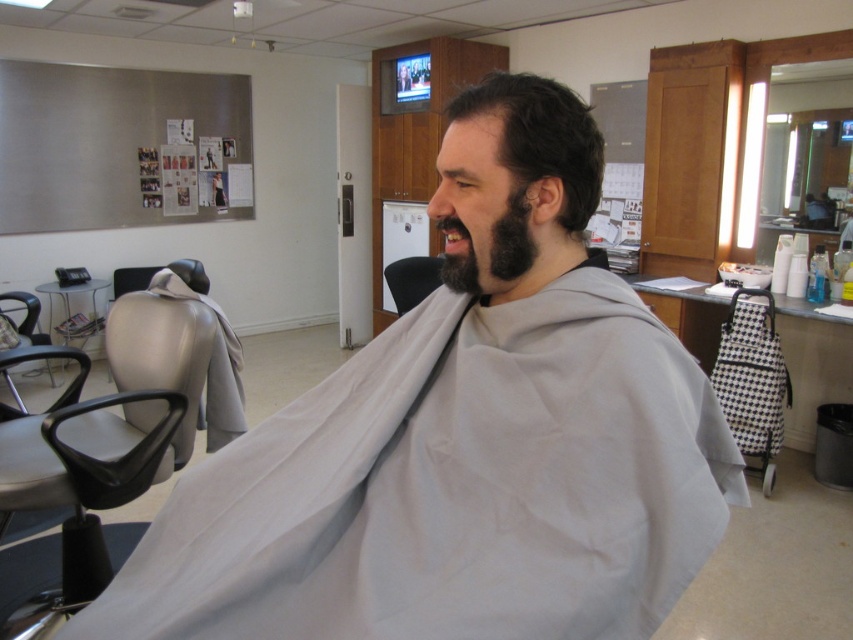
Question: From the image, what is the correct spatial relationship of black fuzzy beard at center in relation to black leather chair at center?

Choices:
 (A) left
 (B) right

Answer: (B)

Question: Considering the real-world distances, which object is closest to the matte gray chair at left?

Choices:
 (A) black leather chair at center
 (B) black plastic chair at left

Answer: (A)

Question: Which point appears farthest from the camera in this image?

Choices:
 (A) (401, 262)
 (B) (521, 221)

Answer: (A)

Question: Can you confirm if matte gray chair at left is positioned to the left of dark brown hair at center?

Choices:
 (A) yes
 (B) no

Answer: (A)

Question: Which of the following is the closest to the observer?

Choices:
 (A) matte gray chair at left
 (B) dark brown hair at center
 (C) black plastic chair at left
 (D) black fuzzy beard at center

Answer: (B)

Question: Is matte gray chair at left thinner than black leather chair at center?

Choices:
 (A) yes
 (B) no

Answer: (B)